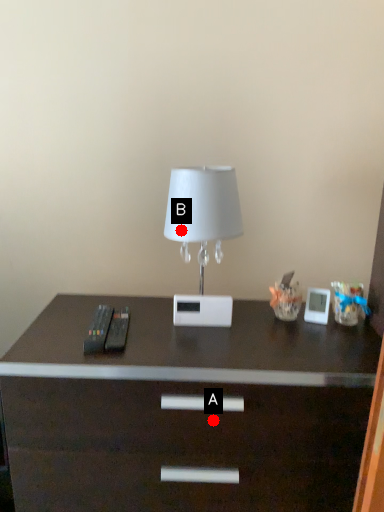
Question: Two points are circled on the image, labeled by A and B beside each circle. Which point appears closest to the camera in this image?

Choices:
 (A) A is closer
 (B) B is closer

Answer: (A)